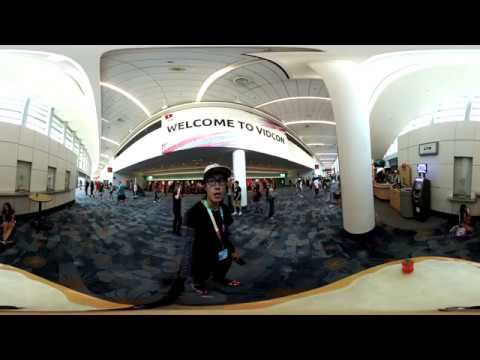
In order to click on pillar in this screenshot , I will do `click(352, 137)`.